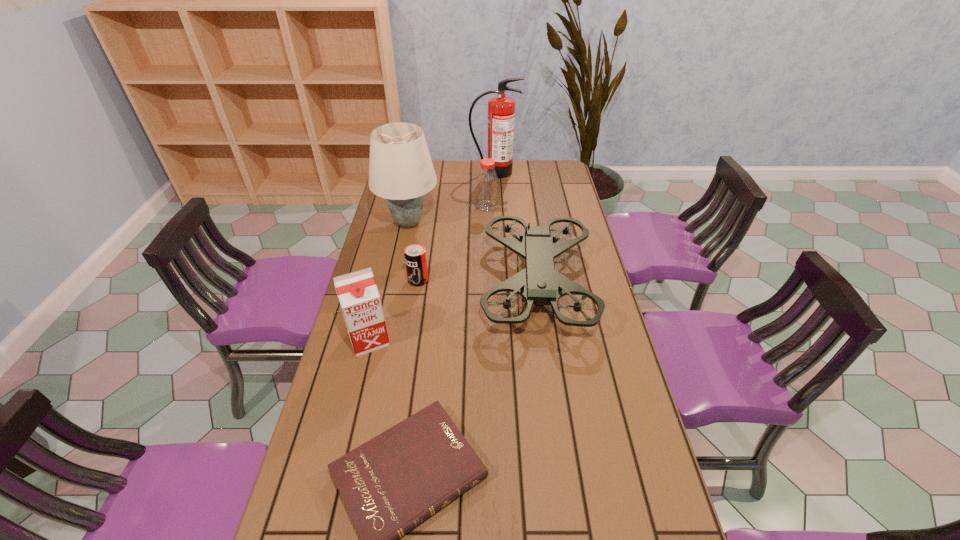
At what (x,y) coordinates should I click in order to perform the action: click on vacant space located on the back of the fifth tallest object. Please return your answer as a coordinate pair (x, y). Image resolution: width=960 pixels, height=540 pixels. Looking at the image, I should click on (486, 161).

The height and width of the screenshot is (540, 960). Identify the location of free space located on the front of the can. (414, 308).

In order to click on object located at the far edge in this screenshot , I will do `click(501, 109)`.

Identify the location of lampshade at the left edge. (400, 168).

The width and height of the screenshot is (960, 540). Find the location of `soya milk at the left edge`. soya milk at the left edge is located at coordinates (357, 292).

I want to click on object that is positioned at the right edge, so click(539, 283).

Locate an element on the screen. Image resolution: width=960 pixels, height=540 pixels. free space at the far edge of the desktop is located at coordinates (510, 179).

Where is `vacant space at the left edge`? vacant space at the left edge is located at coordinates (384, 252).

What are the coordinates of `vacant point at the right edge` in the screenshot? It's located at (603, 343).

At what (x,y) coordinates should I click in order to perform the action: click on vacant space at the far right corner. Please return your answer as a coordinate pair (x, y). Looking at the image, I should click on (x=562, y=160).